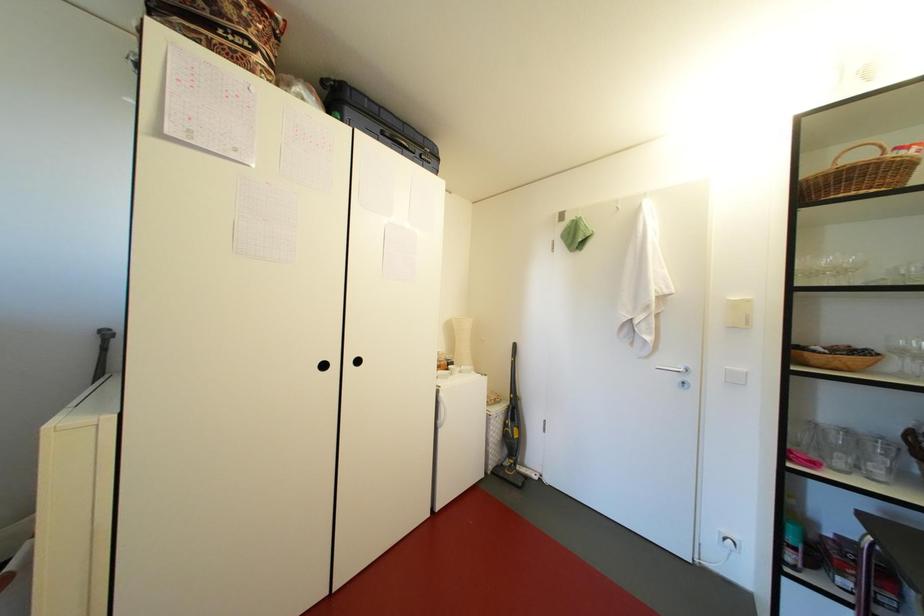
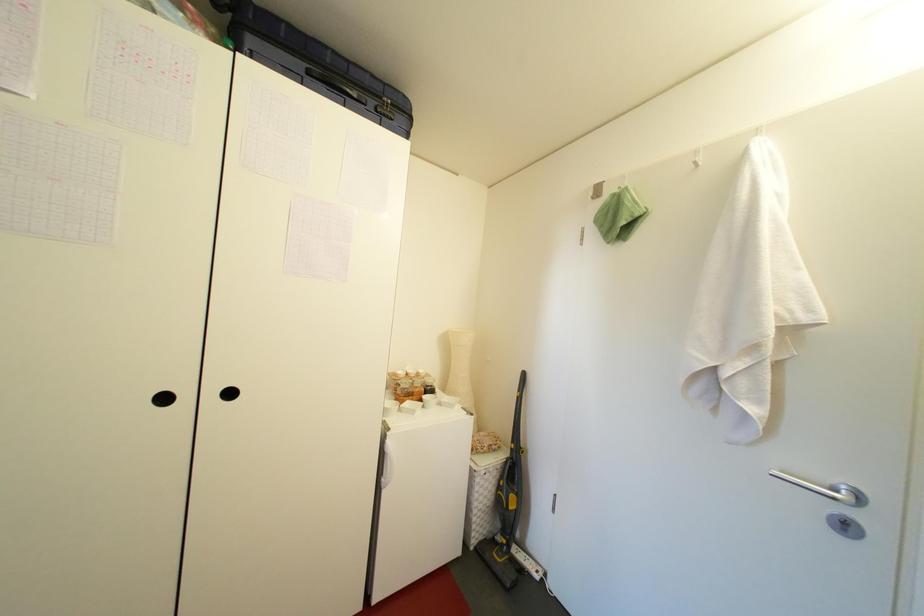
Question: The camera is either moving clockwise (left) or counter-clockwise (right) around the object. The first image is from the beginning of the video and the second image is from the end. Is the camera moving left or right when shooting the video?

Choices:
 (A) Left
 (B) Right

Answer: (B)